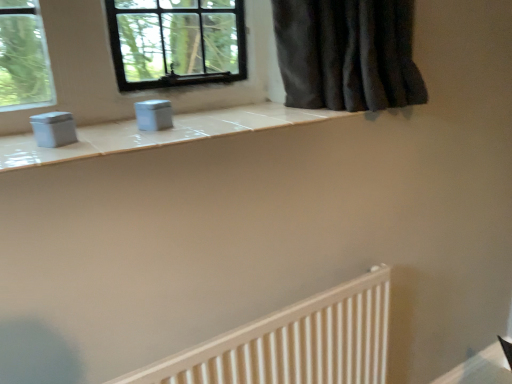
Question: Does white wooden radiator at lower right have a smaller size compared to matte plastic container at center?

Choices:
 (A) yes
 (B) no

Answer: (B)

Question: Considering the relative positions of white wooden radiator at lower right and matte plastic container at center in the image provided, is white wooden radiator at lower right behind matte plastic container at center?

Choices:
 (A) yes
 (B) no

Answer: (B)

Question: Does white wooden radiator at lower right appear on the right side of matte plastic container at center?

Choices:
 (A) no
 (B) yes

Answer: (B)

Question: Is the depth of white wooden radiator at lower right less than that of matte plastic container at center?

Choices:
 (A) yes
 (B) no

Answer: (A)

Question: From the image's perspective, is white wooden radiator at lower right on top of matte plastic container at center?

Choices:
 (A) yes
 (B) no

Answer: (B)

Question: From the image's perspective, is white wooden radiator at lower right beneath matte plastic container at center?

Choices:
 (A) yes
 (B) no

Answer: (A)

Question: Does matte plastic container at center have a greater height compared to white wooden radiator at lower right?

Choices:
 (A) yes
 (B) no

Answer: (B)

Question: Is matte plastic container at center wider than white wooden radiator at lower right?

Choices:
 (A) yes
 (B) no

Answer: (B)

Question: Is the surface of matte plastic container at center in direct contact with white wooden radiator at lower right?

Choices:
 (A) yes
 (B) no

Answer: (B)

Question: Is matte plastic container at center far from white wooden radiator at lower right?

Choices:
 (A) no
 (B) yes

Answer: (A)

Question: Can you confirm if matte plastic container at center is thinner than white wooden radiator at lower right?

Choices:
 (A) yes
 (B) no

Answer: (A)

Question: Is matte plastic container at center shorter than white wooden radiator at lower right?

Choices:
 (A) yes
 (B) no

Answer: (A)

Question: From a real-world perspective, is white wooden radiator at lower right physically located above or below matte plastic container at center?

Choices:
 (A) below
 (B) above

Answer: (A)